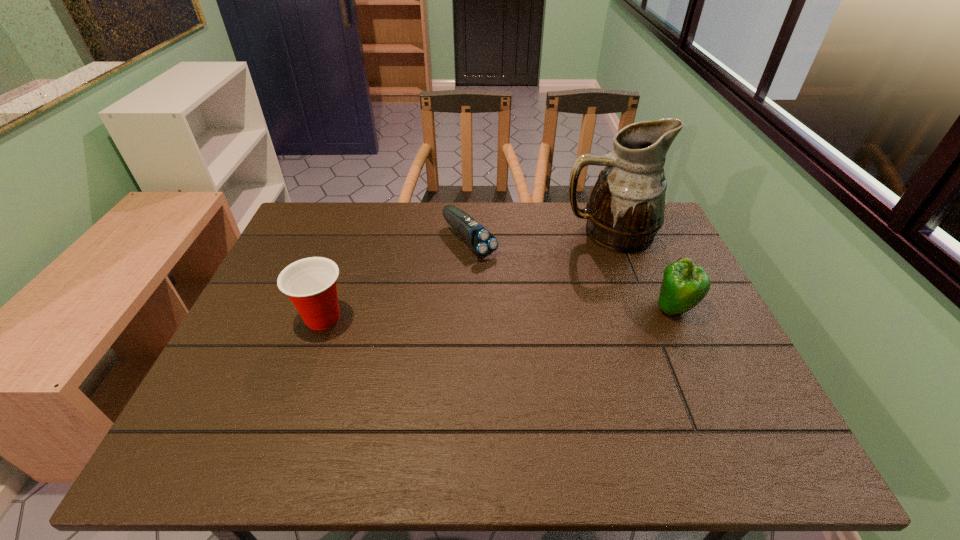
Locate an element on the screen. vacant space at the far edge of the desktop is located at coordinates (411, 207).

In the image, there is a desktop. Where is `free space at the near edge`? Image resolution: width=960 pixels, height=540 pixels. free space at the near edge is located at coordinates (573, 385).

Where is `vacant space at the left edge`? vacant space at the left edge is located at coordinates (285, 266).

At what (x,y) coordinates should I click in order to perform the action: click on vacant space at the right edge of the desktop. Please return your answer as a coordinate pair (x, y). This screenshot has width=960, height=540. Looking at the image, I should click on (698, 315).

You are a GUI agent. You are given a task and a screenshot of the screen. Output one action in this format:
    pyautogui.click(x=<x>, y=<y>)
    Task: Click on the vacant space at the far left corner
    
    Given the screenshot: What is the action you would take?
    pyautogui.click(x=325, y=222)

Find the location of `unoccupied position between the second shortest object and the shortest object`. unoccupied position between the second shortest object and the shortest object is located at coordinates (396, 279).

Locate an element on the screen. This screenshot has height=540, width=960. vacant area between the pitcher and the second object from left to right is located at coordinates (539, 237).

This screenshot has width=960, height=540. I want to click on vacant space in between the cup and the pitcher, so click(466, 275).

The width and height of the screenshot is (960, 540). What are the coordinates of `vacant space in between the leftmost object and the shortest object` in the screenshot? It's located at (396, 279).

Where is `vacant area that lies between the cup and the bell pepper`? Image resolution: width=960 pixels, height=540 pixels. vacant area that lies between the cup and the bell pepper is located at coordinates (498, 313).